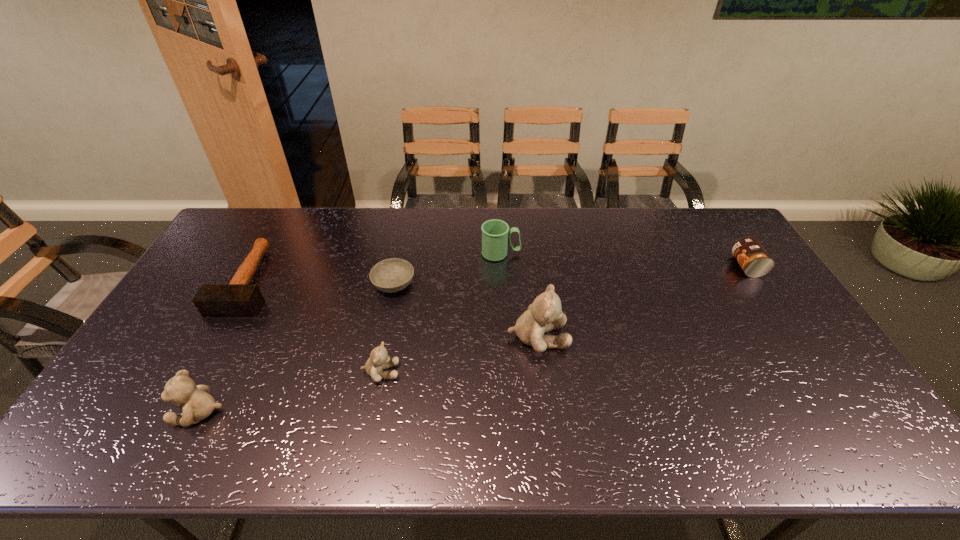
You are a GUI agent. You are given a task and a screenshot of the screen. Output one action in this format:
    pyautogui.click(x=<x>, y=<y>)
    Task: Click on the fifth tallest object
    
    Given the screenshot: What is the action you would take?
    pyautogui.click(x=753, y=259)

Locate an element on the screen. Image resolution: width=960 pixels, height=540 pixels. vacant space located 0.050m on the face of the leftmost teddy bear is located at coordinates (154, 412).

Where is `vacant space situated 0.090m on the face of the leftmost teddy bear`? The width and height of the screenshot is (960, 540). vacant space situated 0.090m on the face of the leftmost teddy bear is located at coordinates (137, 412).

The height and width of the screenshot is (540, 960). Identify the location of vacant region located on the face of the second nearest object. (456, 372).

Identify the location of vacant space located 0.070m on the face of the third nearest object. Image resolution: width=960 pixels, height=540 pixels. (593, 338).

This screenshot has height=540, width=960. I want to click on free space located 0.080m on the hammer head face of the sixth tallest object, so click(217, 338).

Image resolution: width=960 pixels, height=540 pixels. What are the coordinates of `vacant area located 0.060m on the side of the mug with the handle` in the screenshot? It's located at (538, 254).

The height and width of the screenshot is (540, 960). I want to click on free space located on the left of the shortest object, so click(x=357, y=285).

Locate an element on the screen. vacant space located on the front label of the rightmost object is located at coordinates (637, 266).

Where is `vacant area located 0.260m on the front label of the rightmost object`? This screenshot has width=960, height=540. vacant area located 0.260m on the front label of the rightmost object is located at coordinates (656, 266).